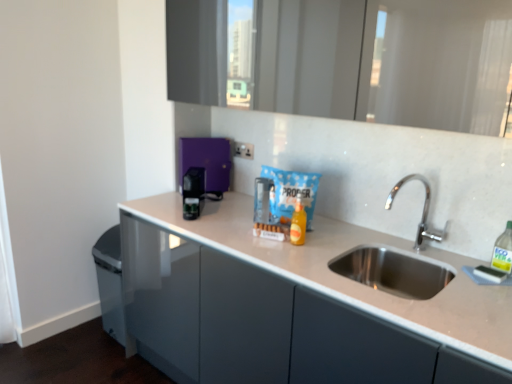
Identify the location of vacant region to the left of translucent orange bottle at center, the second bottle positioned from the front. This screenshot has width=512, height=384. (249, 241).